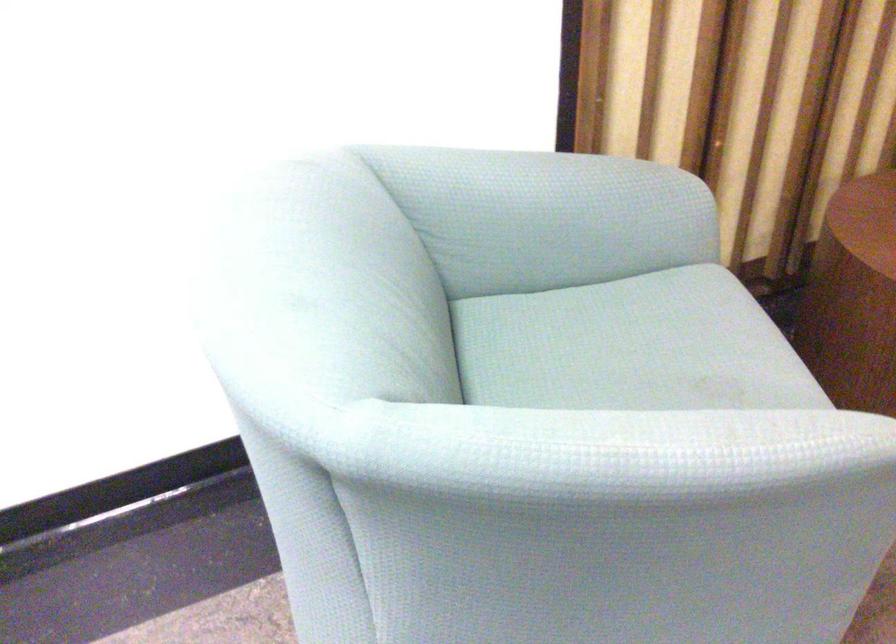
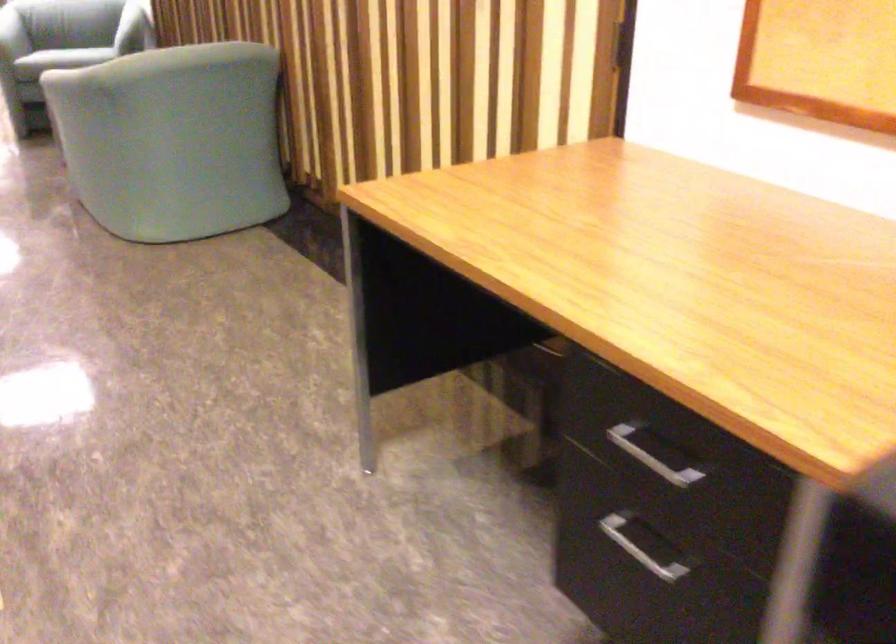
Find the pixel in the second image that matches point (762, 397) in the first image.

(12, 35)